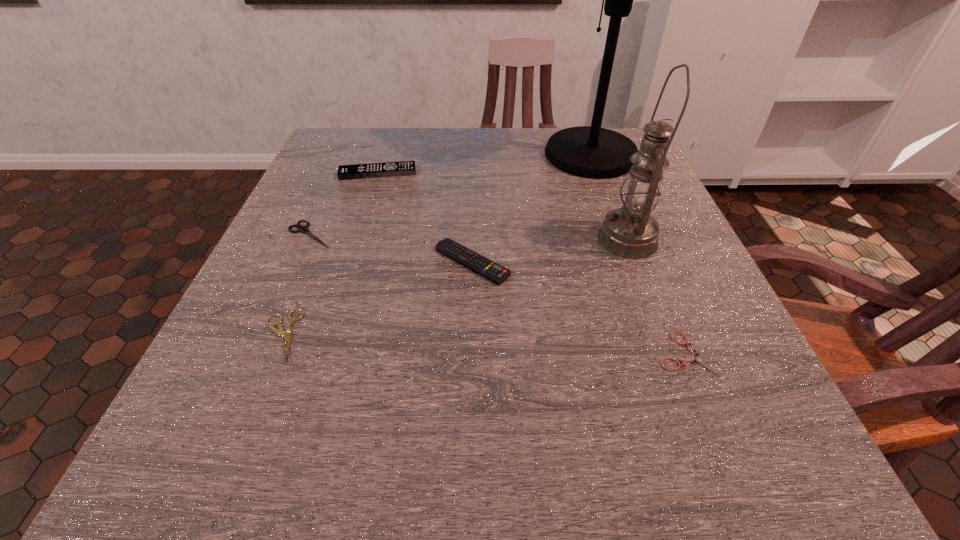
You are a GUI agent. You are given a task and a screenshot of the screen. Output one action in this format:
    pyautogui.click(x=<x>, y=<y>)
    Task: Click on the third closest object to the fifth tallest object
    The image size is (960, 540).
    Given the screenshot: What is the action you would take?
    pyautogui.click(x=464, y=256)

The image size is (960, 540). What are the coordinates of `object that ranks as the sixth closest to the nearer remote control` in the screenshot? It's located at pos(593,152).

Point out which shears is positioned as the nearest to the second tallest shears. Please provide its 2D coordinates. Your answer should be formatted as a tuple, i.e. [(x, y)], where the tuple contains the x and y coordinates of a point satisfying the conditions above.

[(303, 229)]

Locate which shears is the second closest to the second tallest object. Please provide its 2D coordinates. Your answer should be formatted as a tuple, i.e. [(x, y)], where the tuple contains the x and y coordinates of a point satisfying the conditions above.

[(303, 229)]

At what (x,y) coordinates should I click in order to perform the action: click on vacant space that satisfies the following two spatial constraints: 1. on the back side of the second shortest object; 2. on the left side of the table lamp. Please return your answer as a coordinate pair (x, y). Looking at the image, I should click on 355,155.

This screenshot has height=540, width=960. Find the location of `vacant region that satisfies the following two spatial constraints: 1. on the front side of the taller remote control; 2. on the right side of the shorter remote control`. vacant region that satisfies the following two spatial constraints: 1. on the front side of the taller remote control; 2. on the right side of the shorter remote control is located at coordinates (349, 262).